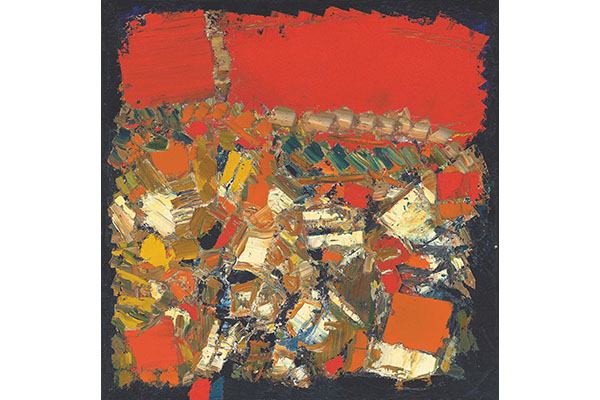
The width and height of the screenshot is (600, 400). What are the coordinates of `right of painting` in the screenshot? It's located at (472, 177).